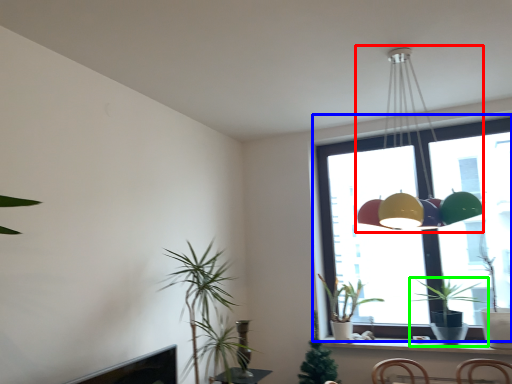
Question: Considering the real-world distances, which object is closest to lamp (highlighted by a red box)? window (highlighted by a blue box) or houseplant (highlighted by a green box).

Choices:
 (A) window
 (B) houseplant

Answer: (A)